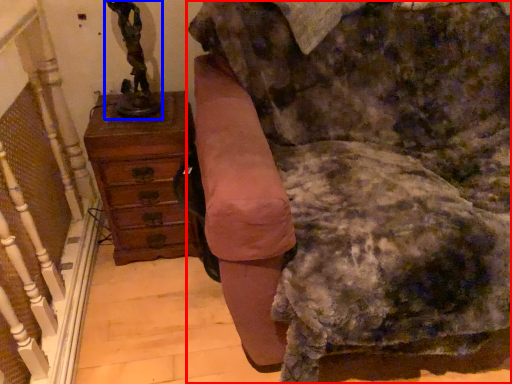
Question: Among these objects, which one is farthest to the camera, furniture (highlighted by a red box) or sculpture (highlighted by a blue box)?

Choices:
 (A) furniture
 (B) sculpture

Answer: (B)